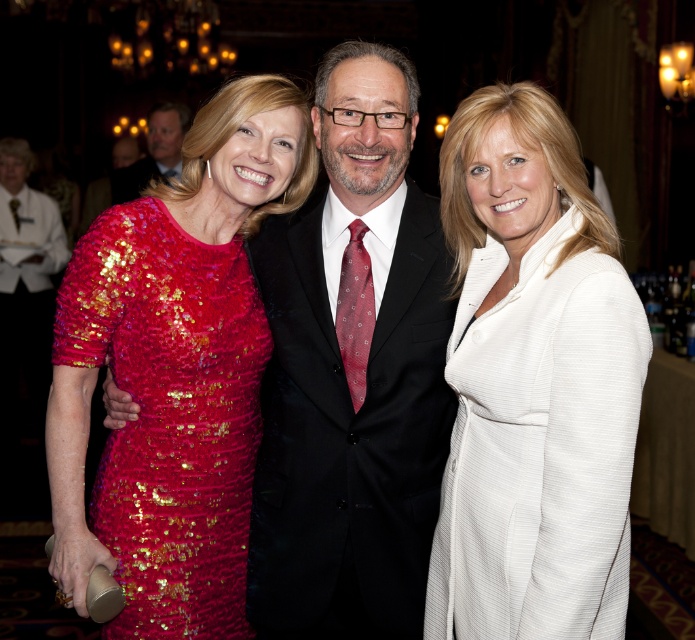
Does shiny black suit at center appear on the right side of sequined red dress at left?

Yes, shiny black suit at center is to the right of sequined red dress at left.

Describe the element at coordinates (351, 372) in the screenshot. The width and height of the screenshot is (695, 640). I see `shiny black suit at center` at that location.

Where is `shiny black suit at center`? shiny black suit at center is located at coordinates (351, 372).

Can you confirm if shiny burgundy tie at center is positioned to the right of matte black suit at center?

Correct, you'll find shiny burgundy tie at center to the right of matte black suit at center.

Can you confirm if shiny burgundy tie at center is taller than matte black suit at center?

Incorrect, shiny burgundy tie at center's height is not larger of matte black suit at center's.

What are the coordinates of `shiny burgundy tie at center` in the screenshot? It's located at (354, 310).

Does white textured coat at center have a lesser width compared to shiny black suit at center?

Yes, white textured coat at center is thinner than shiny black suit at center.

Who is more distant from viewer, (523, 611) or (284, 400)?

Positioned behind is point (284, 400).

Who is more forward, (x=564, y=474) or (x=391, y=92)?

Point (x=564, y=474) is more forward.

At what (x,y) coordinates should I click in order to perform the action: click on white textured coat at center. Please return your answer as a coordinate pair (x, y). Looking at the image, I should click on (532, 384).